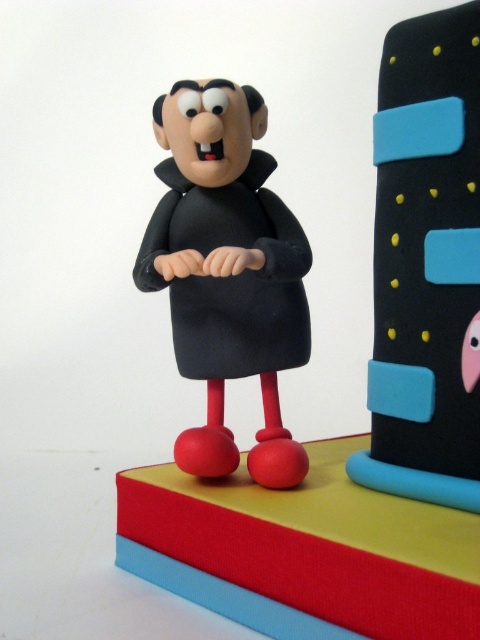
You are designing a display case for the matte black tower at upper right and the matte black figurine at center. Since the display case has limited space, which object requires a wider space to accommodate its width?

The matte black figurine at center requires a wider space because it has a greater width than the matte black tower at upper right, which is narrower.

You are a collector examining a display of figurines. You see a point at coordinate (427, 264). What object is located there?

The point at coordinate (427, 264) is where the matte black tower at upper right is located.

You are designing a display case for two items, the matte black tower at upper right and the matte black figurine at center. The case has a height limit of 15 cm. If the tower is already 14 cm tall, will the figurine fit comfortably without exceeding the height limit?

The matte black tower at upper right is bigger than the matte black figurine at center. Since the tower is 14 cm tall and the case has a 15 cm limit, the figurine, being smaller, will fit comfortably within the height limit.